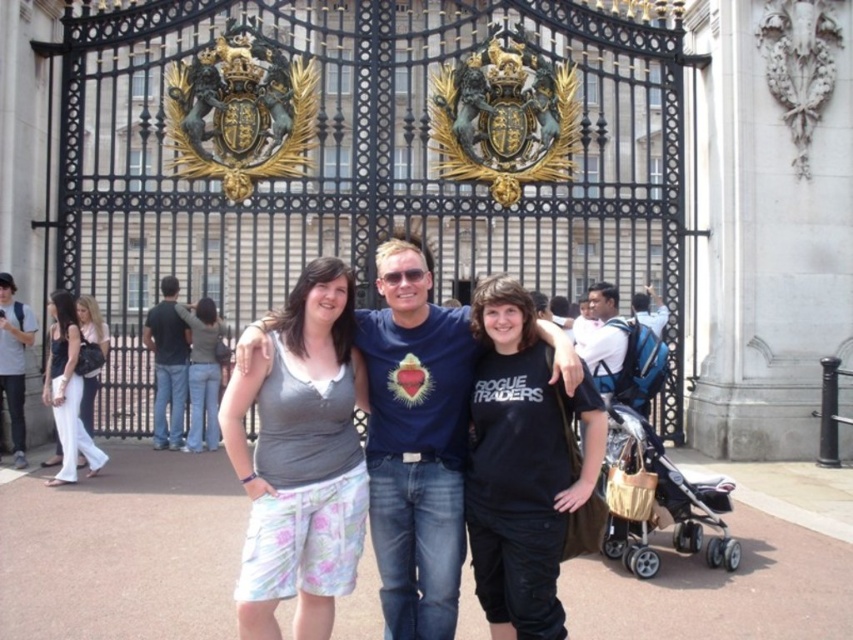
Between white backpack at center and blue t-shirt at center, which one appears on the left side from the viewer's perspective?

blue t-shirt at center is more to the left.

Which is in front, point (614, 342) or point (587, 310)?

Point (614, 342) is more forward.

Identify the location of white backpack at center. (602, 337).

Is point (96, 458) positioned before point (183, 432)?

Yes, point (96, 458) is in front of point (183, 432).

Measure the distance from matte white pants at left to dark gray shirt at left.

matte white pants at left and dark gray shirt at left are 6.60 meters apart.

Between point (62, 401) and point (154, 314), which one is positioned behind?

The point (154, 314) is more distant.

The image size is (853, 640). I want to click on matte white pants at left, so click(x=67, y=390).

Measure the distance from dark gray shirt at left to white backpack at center.

They are 32.57 meters apart.

Between point (184, 396) and point (612, 372), which one is positioned in front?

Positioned in front is point (612, 372).

Which is behind, point (175, 342) or point (601, 364)?

The point (175, 342) is behind.

Identify the location of dark gray shirt at left. This screenshot has height=640, width=853. (167, 364).